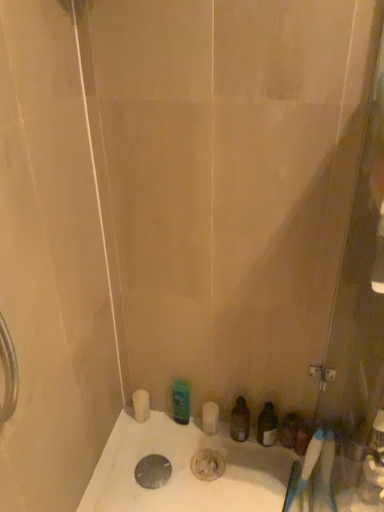
Question: Considering the relative sizes of metallic silver drain at bottom center and green matte bottle at center, the 1th toiletry in the left-to-right sequence, in the image provided, is metallic silver drain at bottom center smaller than green matte bottle at center, the 1th toiletry in the left-to-right sequence,?

Choices:
 (A) yes
 (B) no

Answer: (A)

Question: Does metallic silver drain at bottom center have a greater height compared to green matte bottle at center, the 1th toiletry in the left-to-right sequence?

Choices:
 (A) yes
 (B) no

Answer: (B)

Question: From a real-world perspective, is metallic silver drain at bottom center beneath green matte bottle at center, marked as the third toiletry in a right-to-left arrangement?

Choices:
 (A) yes
 (B) no

Answer: (A)

Question: Considering the relative positions of metallic silver drain at bottom center and green matte bottle at center, marked as the third toiletry in a right-to-left arrangement, in the image provided, is metallic silver drain at bottom center behind green matte bottle at center, marked as the third toiletry in a right-to-left arrangement,?

Choices:
 (A) no
 (B) yes

Answer: (A)

Question: Is green matte bottle at center, the 1th toiletry in the left-to-right sequence, a part of metallic silver drain at bottom center?

Choices:
 (A) yes
 (B) no

Answer: (B)

Question: Considering the relative sizes of metallic silver drain at bottom center and green matte bottle at center, the 1th toiletry in the left-to-right sequence, in the image provided, is metallic silver drain at bottom center bigger than green matte bottle at center, the 1th toiletry in the left-to-right sequence,?

Choices:
 (A) yes
 (B) no

Answer: (B)

Question: From a real-world perspective, is white matte toilet paper at lower left on metallic silver drain at bottom center?

Choices:
 (A) no
 (B) yes

Answer: (B)

Question: From the image's perspective, does white matte toilet paper at lower left appear higher than metallic silver drain at bottom center?

Choices:
 (A) no
 (B) yes

Answer: (B)

Question: Is the depth of white matte toilet paper at lower left less than that of metallic silver drain at bottom center?

Choices:
 (A) yes
 (B) no

Answer: (B)

Question: Is white matte toilet paper at lower left positioned beyond the bounds of metallic silver drain at bottom center?

Choices:
 (A) no
 (B) yes

Answer: (B)

Question: Is white matte toilet paper at lower left shorter than metallic silver drain at bottom center?

Choices:
 (A) no
 (B) yes

Answer: (A)

Question: From the image's perspective, is white matte toilet paper at lower left beneath metallic silver drain at bottom center?

Choices:
 (A) no
 (B) yes

Answer: (A)

Question: From a real-world perspective, is white plastic toothbrush at lower right below green matte bottle at center, marked as the third toiletry in a right-to-left arrangement?

Choices:
 (A) no
 (B) yes

Answer: (A)